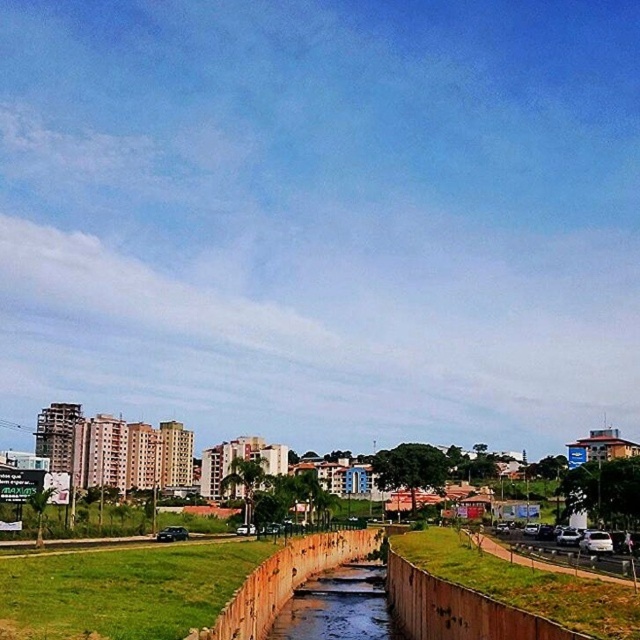
You are standing at the grassy area near the waterway and want to take a photo of both point (67,593) and point (534,570) in the image. Which point should you focus on first to ensure both are in the frame?

You should focus on point (67,593) first because it is closer to the camera than point (534,570), ensuring both points are within the frame.

You are a drone operator who needs to capture a closeup shot of the green grass at lower center. The drone can only fly up to 100 feet away from its starting position. Can you get the shot without moving the drone beyond its maximum range?

The green grass at lower center is 120.21 feet from the camera, which exceeds the drone operator can fly up to 100 feet. Therefore, the drone cannot reach the green grass at lower center without moving beyond its maximum range.

Looking at this image, you are a gardener standing at the edge of the green grass at lower center. You need to water the brown concrete river at center. Which direction should you move to reach it?

The brown concrete river at center is to the left of the green grass at lower center, so you should move to the left to reach it.